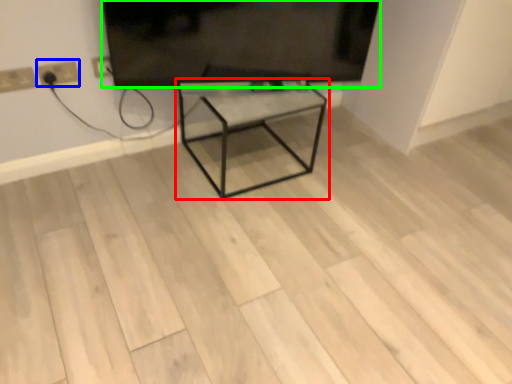
Question: Estimate the real-world distances between objects in this image. Which object is farther from table (highlighted by a red box), electric outlet (highlighted by a blue box) or television (highlighted by a green box)?

Choices:
 (A) electric outlet
 (B) television

Answer: (A)